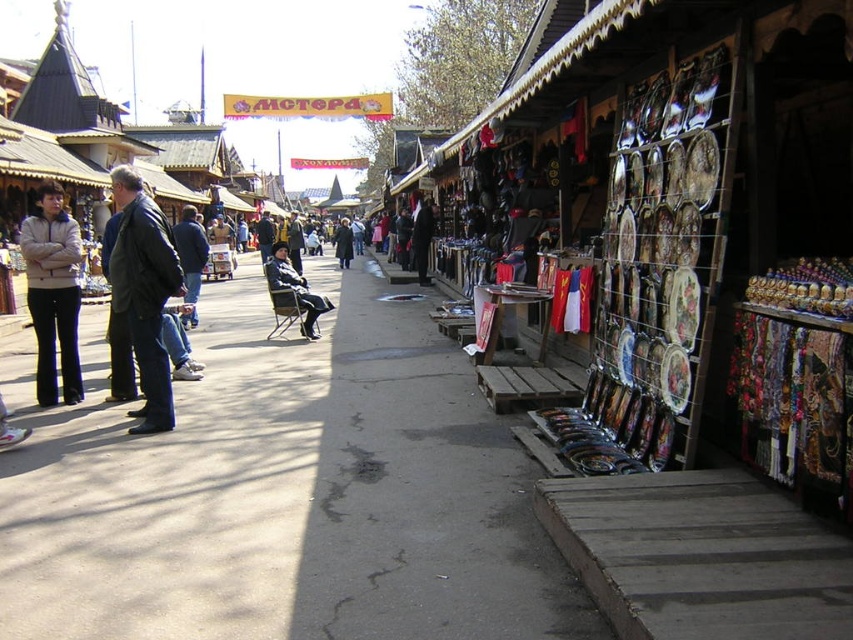
Looking at this image, between dark blue leather jacket at left and matte beige jacket at left, which one is positioned lower?

dark blue leather jacket at left is below.

Locate an element on the screen. This screenshot has width=853, height=640. dark blue leather jacket at left is located at coordinates (144, 292).

Is point (146, 196) closer to camera compared to point (50, 248)?

Yes, point (146, 196) is in front of point (50, 248).

Identify the location of dark blue leather jacket at left. The height and width of the screenshot is (640, 853). (144, 292).

Who is positioned more to the left, concrete sidewalk at center or matte beige jacket at left?

Positioned to the left is matte beige jacket at left.

Who is more distant from viewer, (523,531) or (77,365)?

Positioned behind is point (77,365).

Where is `concrete sidewalk at center`? The height and width of the screenshot is (640, 853). concrete sidewalk at center is located at coordinates tap(285, 493).

Between concrete sidewalk at center and dark green coat at center, which one is positioned higher?

dark green coat at center is higher up.

Which is behind, point (412, 321) or point (345, 241)?

Point (345, 241)

Does point (136, 602) come farther from viewer compared to point (350, 253)?

No, (136, 602) is in front of (350, 253).

Locate an element on the screen. The height and width of the screenshot is (640, 853). concrete sidewalk at center is located at coordinates (285, 493).